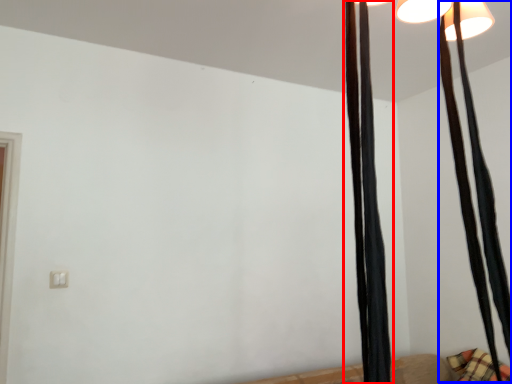
Question: Which object is closer to the camera taking this photo, curtain (highlighted by a red box) or curtain (highlighted by a blue box)?

Choices:
 (A) curtain
 (B) curtain

Answer: (A)